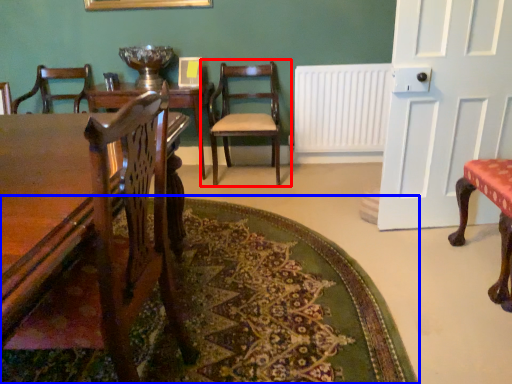
Question: Among these objects, which one is farthest to the camera, chair (highlighted by a red box) or mat (highlighted by a blue box)?

Choices:
 (A) chair
 (B) mat

Answer: (A)